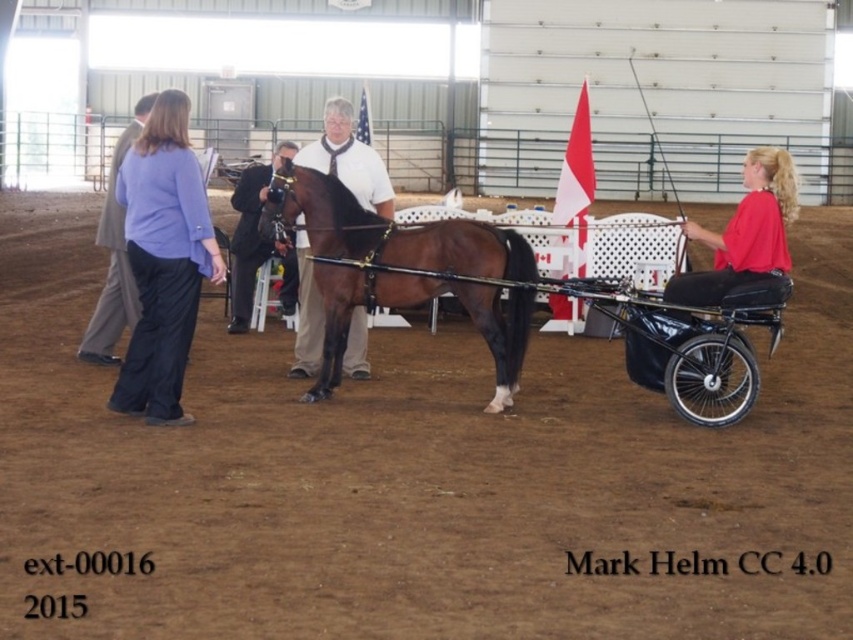
Can you confirm if purple fabric pants at left is shorter than dark suit at center?

No, purple fabric pants at left is not shorter than dark suit at center.

Is point (154, 180) closer to viewer compared to point (263, 184)?

Yes, it is.

Identify the location of purple fabric pants at left. This screenshot has height=640, width=853. (163, 260).

Can you confirm if white glossy shirt at center is wider than light brown suit at left?

Correct, the width of white glossy shirt at center exceeds that of light brown suit at left.

Is white glossy shirt at center bigger than light brown suit at left?

Yes.

This screenshot has width=853, height=640. In order to click on white glossy shirt at center in this screenshot , I will do `click(347, 160)`.

The width and height of the screenshot is (853, 640). Find the location of `brown glossy horse at center`. brown glossy horse at center is located at coordinates (404, 268).

The width and height of the screenshot is (853, 640). What do you see at coordinates (404, 268) in the screenshot? I see `brown glossy horse at center` at bounding box center [404, 268].

What do you see at coordinates (404, 268) in the screenshot? I see `brown glossy horse at center` at bounding box center [404, 268].

At what (x,y) coordinates should I click in order to perform the action: click on brown glossy horse at center. Please return your answer as a coordinate pair (x, y). Image resolution: width=853 pixels, height=640 pixels. Looking at the image, I should click on (404, 268).